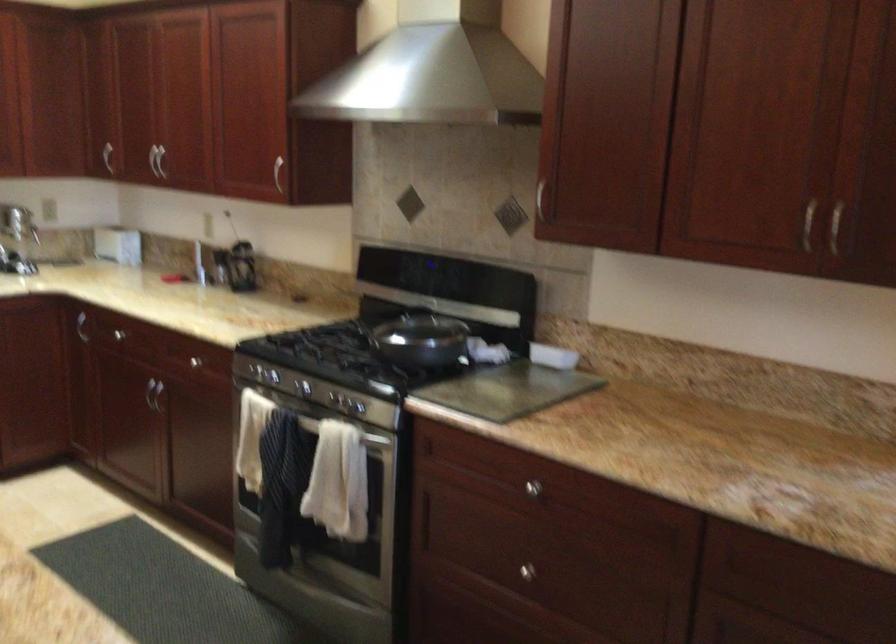
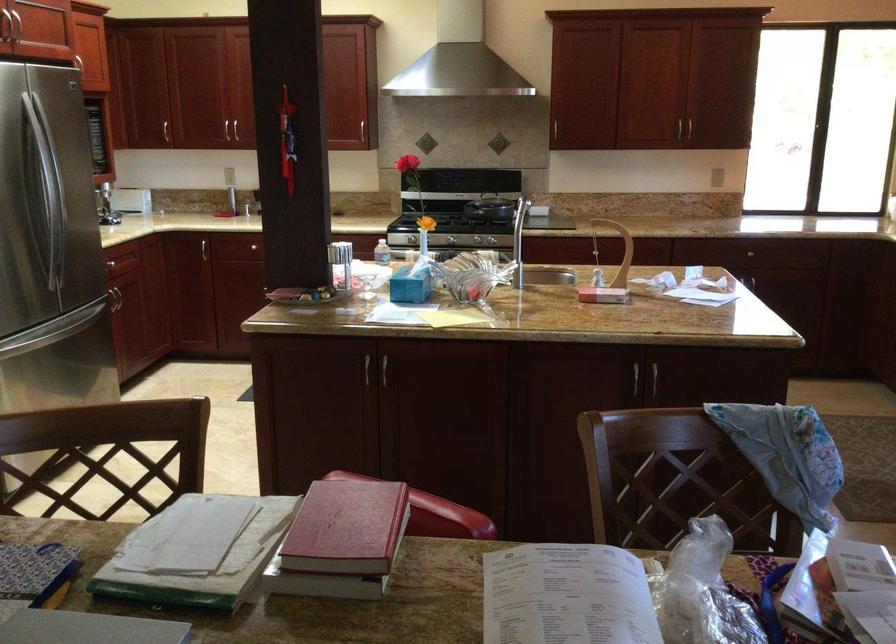
Find the pixel in the second image that matches pixel 213 272 in the first image.

(202, 205)